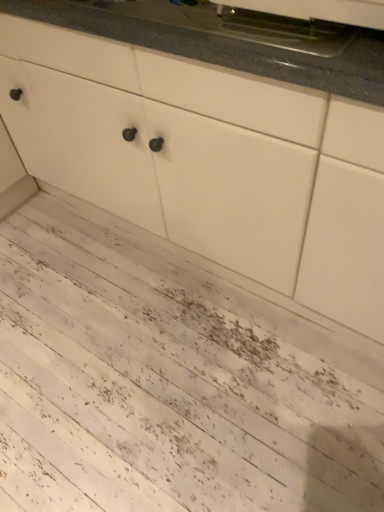
Question: In which direction should I rotate to look at metallic stainless steel oven at upper center?

Choices:
 (A) right
 (B) left

Answer: (A)

Question: Considering the relative positions of white matte cabinet at center and metallic stainless steel oven at upper center in the image provided, is white matte cabinet at center to the right of metallic stainless steel oven at upper center from the viewer's perspective?

Choices:
 (A) yes
 (B) no

Answer: (B)

Question: Does white matte cabinet at center have a lesser height compared to metallic stainless steel oven at upper center?

Choices:
 (A) no
 (B) yes

Answer: (A)

Question: Does white matte cabinet at center have a greater width compared to metallic stainless steel oven at upper center?

Choices:
 (A) no
 (B) yes

Answer: (B)

Question: Is white matte cabinet at center far away from metallic stainless steel oven at upper center?

Choices:
 (A) no
 (B) yes

Answer: (A)

Question: Is white matte cabinet at center not inside metallic stainless steel oven at upper center?

Choices:
 (A) no
 (B) yes

Answer: (B)

Question: From a real-world perspective, is white matte cabinet at center positioned over metallic stainless steel oven at upper center based on gravity?

Choices:
 (A) no
 (B) yes

Answer: (A)

Question: Can you confirm if white textured wood at lower left is shorter than white matte cabinet at center?

Choices:
 (A) yes
 (B) no

Answer: (A)

Question: Is the position of white textured wood at lower left less distant than that of white matte cabinet at center?

Choices:
 (A) yes
 (B) no

Answer: (B)

Question: Considering the relative positions of white textured wood at lower left and white matte cabinet at center in the image provided, is white textured wood at lower left to the left of white matte cabinet at center from the viewer's perspective?

Choices:
 (A) no
 (B) yes

Answer: (B)

Question: From a real-world perspective, is white textured wood at lower left located beneath white matte cabinet at center?

Choices:
 (A) no
 (B) yes

Answer: (B)

Question: From the image's perspective, is white textured wood at lower left below white matte cabinet at center?

Choices:
 (A) no
 (B) yes

Answer: (B)

Question: Is white textured wood at lower left positioned with its back to white matte cabinet at center?

Choices:
 (A) yes
 (B) no

Answer: (B)

Question: Is metallic stainless steel oven at upper center taller than granite gray countertop at upper center?

Choices:
 (A) no
 (B) yes

Answer: (A)